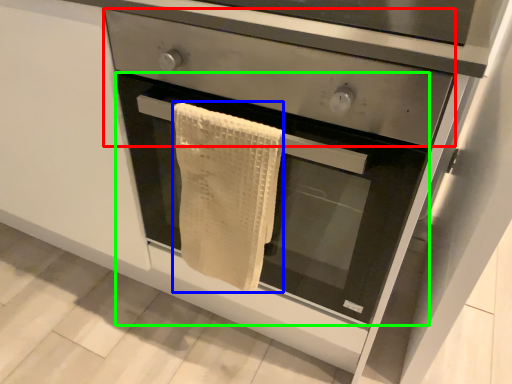
Question: Which object is positioned farthest from drawer (highlighted by a red box)? Select from bath towel (highlighted by a blue box) and oven (highlighted by a green box).

Choices:
 (A) bath towel
 (B) oven

Answer: (B)